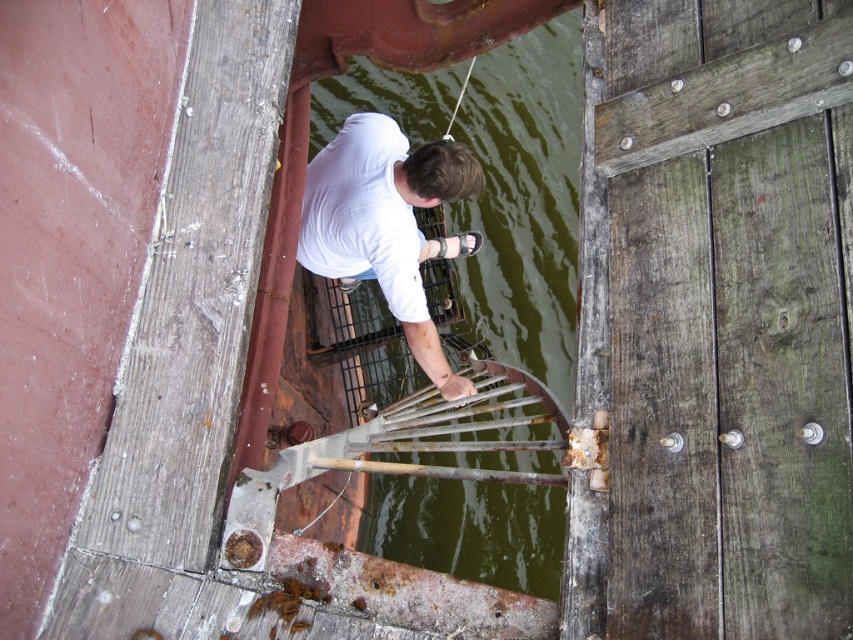
Which is more to the left, green murky water at center or white matte shirt at center?

From the viewer's perspective, white matte shirt at center appears more on the left side.

Who is lower down, green murky water at center or white matte shirt at center?

white matte shirt at center is lower down.

I want to click on green murky water at center, so click(x=525, y=198).